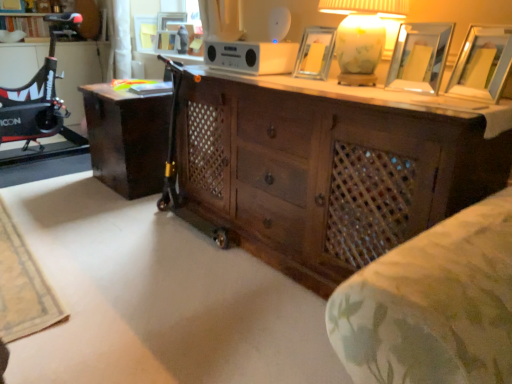
I want to click on vacant area situated to the left side of metallic silver picture frame at upper center, which ranks as the 3th picture frame in top-to-bottom order, so click(283, 79).